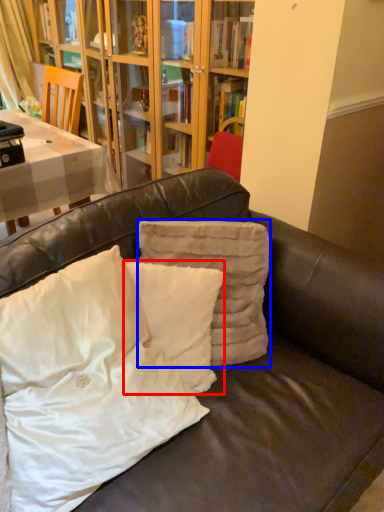
Question: Which point is further to the camera, pillow (highlighted by a red box) or pillow (highlighted by a blue box)?

Choices:
 (A) pillow
 (B) pillow

Answer: (B)